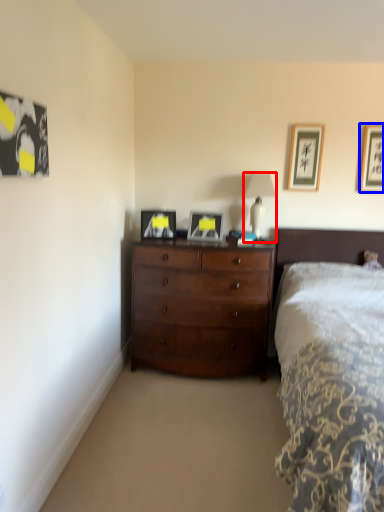
Question: Which of the following is the closest to the observer, table lamp (highlighted by a red box) or picture frame (highlighted by a blue box)?

Choices:
 (A) table lamp
 (B) picture frame

Answer: (A)